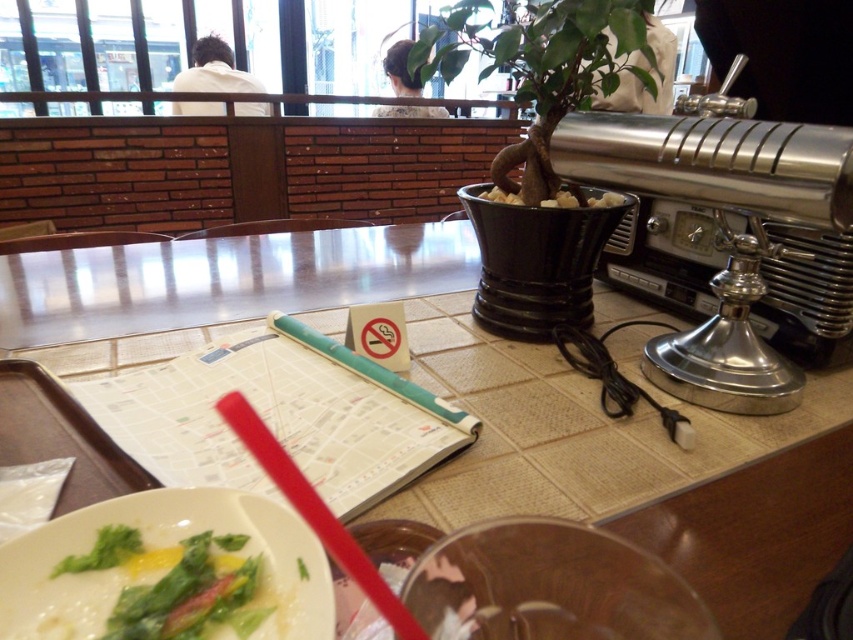
In the scene shown: You are a photographer taking a picture of the table scene. You notice two points marked in the image. Which point, point 1 at coordinates (x=120, y=552) or point 2 at (x=247, y=435), will appear larger in your photo?

Point 1 at coordinates (x=120, y=552) will appear larger in the photo because it is closer to the camera than point 2 at (x=247, y=435).